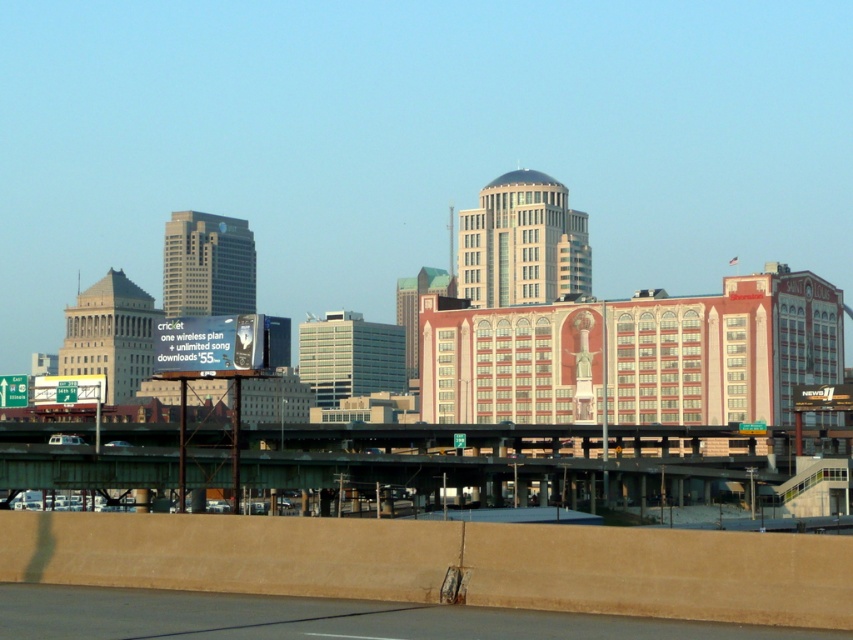
You are a delivery driver who needs to reach the green metallic bridge at center from the concrete pavement at lower center. Given that your truck requires a minimum clearance of 4.5 meters, can you safely drive towards the bridge without any obstacles?

The green metallic bridge at center is 169.42 meters away from concrete pavement at lower center. Since the distance is sufficient and there are no mentioned obstacles in the scene description, the truck can safely drive towards the bridge as long as the clearance is maintained. However, the provided information does not specify the height of the bridge, so it is recommended to verify the clearance before proceeding.

You are a city planner assessing the space between the green metallic bridge at center and the concrete pavement at lower center. Which object occupies more area in the scene?

The green metallic bridge at center has a larger size compared to the concrete pavement at lower center, so it occupies more area.

You are a drone operator who needs to fly a drone from the green metallic bridge at center to the concrete pavement at lower center. Considering their heights, will the drone have to ascend or descend to reach the destination?

The green metallic bridge at center is much taller than the concrete pavement at lower center, so the drone will have to descend to reach the destination.